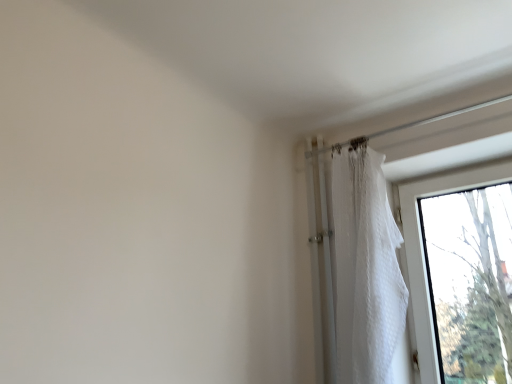
Locate an element on the screen. transparent glass window at right is located at coordinates (423, 252).

The height and width of the screenshot is (384, 512). What do you see at coordinates (423, 252) in the screenshot?
I see `transparent glass window at right` at bounding box center [423, 252].

What are the coordinates of `white textured curtain at right` in the screenshot? It's located at (366, 271).

Describe the element at coordinates (366, 271) in the screenshot. I see `white textured curtain at right` at that location.

You are a GUI agent. You are given a task and a screenshot of the screen. Output one action in this format:
    pyautogui.click(x=<x>, y=<y>)
    Task: Click on the transparent glass window at right
    The image size is (512, 384).
    Given the screenshot: What is the action you would take?
    pyautogui.click(x=423, y=252)

Visually, is transparent glass window at right positioned to the left or to the right of white textured curtain at right?

Based on their positions, transparent glass window at right is located to the right of white textured curtain at right.

Which object is closer to the camera, transparent glass window at right or white textured curtain at right?

white textured curtain at right.

Which is behind, point (439, 186) or point (358, 256)?

The point (439, 186) is more distant.

From the image's perspective, which one is positioned higher, transparent glass window at right or white textured curtain at right?

white textured curtain at right is shown above in the image.

From a real-world perspective, is transparent glass window at right physically located above or below white textured curtain at right?

From a real-world perspective, transparent glass window at right is physically below white textured curtain at right.

Considering the sizes of objects transparent glass window at right and white textured curtain at right in the image provided, who is thinner, transparent glass window at right or white textured curtain at right?

Thinner between the two is transparent glass window at right.

Who is taller, transparent glass window at right or white textured curtain at right?

white textured curtain at right is taller.

Considering the sizes of objects transparent glass window at right and white textured curtain at right in the image provided, who is smaller, transparent glass window at right or white textured curtain at right?

white textured curtain at right.

Is white textured curtain at right inside transparent glass window at right?

No, white textured curtain at right is not surrounded by transparent glass window at right.

Is there a large distance between transparent glass window at right and white textured curtain at right?

transparent glass window at right is actually quite close to white textured curtain at right.

In the scene shown: Is transparent glass window at right oriented towards white textured curtain at right?

Yes.

The height and width of the screenshot is (384, 512). I want to click on curtain located on the left of transparent glass window at right, so click(366, 271).

Between white textured curtain at right and transparent glass window at right, which one appears on the left side from the viewer's perspective?

white textured curtain at right.

Does white textured curtain at right lie in front of transparent glass window at right?

Yes, white textured curtain at right is in front of transparent glass window at right.

Is point (365, 363) farther from camera compared to point (420, 193)?

No.

From the image's perspective, is white textured curtain at right on transparent glass window at right?

Correct, white textured curtain at right appears higher than transparent glass window at right in the image.

From a real-world perspective, which object stands above the other?

From a 3D spatial view, white textured curtain at right is above.

Which of these two, white textured curtain at right or transparent glass window at right, is wider?

white textured curtain at right.

Based on the photo, which of these two, white textured curtain at right or transparent glass window at right, stands shorter?

With less height is transparent glass window at right.

Can you confirm if white textured curtain at right is smaller than transparent glass window at right?

Correct, white textured curtain at right occupies less space than transparent glass window at right.

Is white textured curtain at right surrounding transparent glass window at right?

Actually, transparent glass window at right is outside white textured curtain at right.

Does white textured curtain at right touch transparent glass window at right?

No, white textured curtain at right is not touching transparent glass window at right.

Is white textured curtain at right oriented towards transparent glass window at right?

No.

You are a GUI agent. You are given a task and a screenshot of the screen. Output one action in this format:
    pyautogui.click(x=<x>, y=<y>)
    Task: Click on the window behind the white textured curtain at right
    
    Given the screenshot: What is the action you would take?
    pyautogui.click(x=423, y=252)

Find the location of a particular element. The width and height of the screenshot is (512, 384). window below the white textured curtain at right (from the image's perspective) is located at coordinates (423, 252).

Find the location of a particular element. This screenshot has width=512, height=384. window below the white textured curtain at right (from a real-world perspective) is located at coordinates (423, 252).